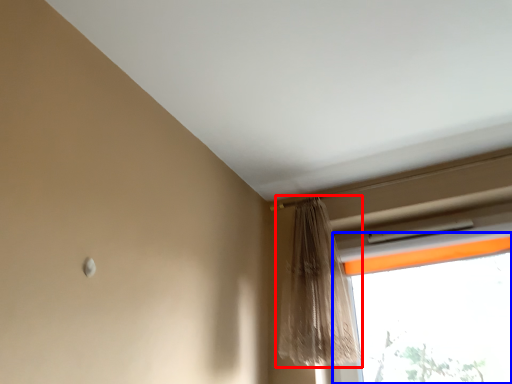
Question: Which point is further to the camera, curtain (highlighted by a red box) or window (highlighted by a blue box)?

Choices:
 (A) curtain
 (B) window

Answer: (B)